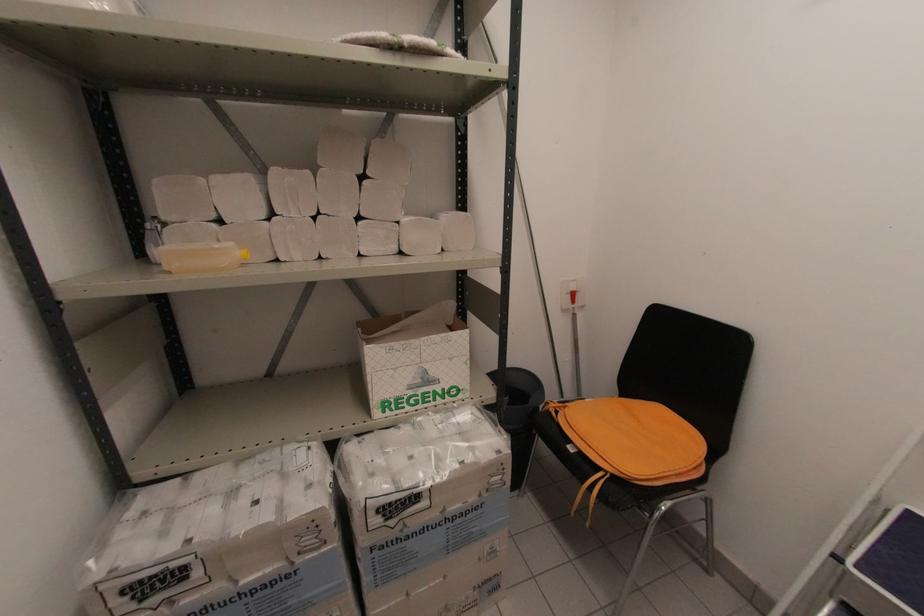
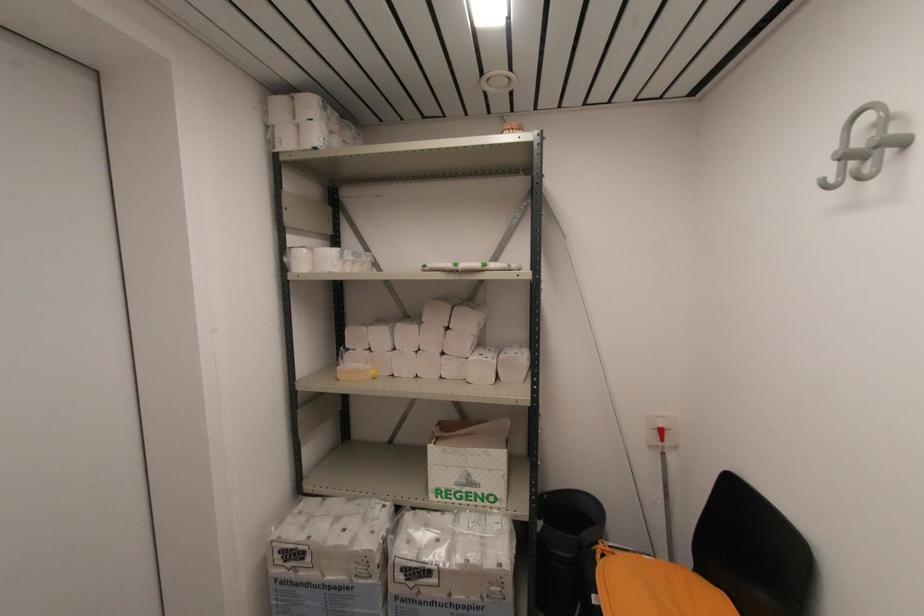
Find the pixel in the second image that matches point 451,415 in the first image.

(484, 517)